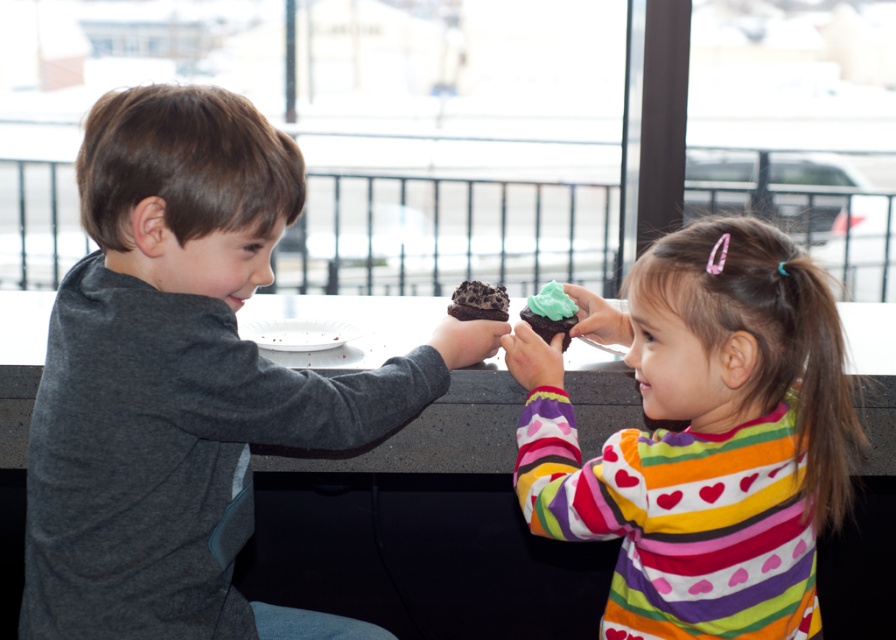
Does pastel striped shirt at center have a lesser height compared to green frosting cupcake at center?

In fact, pastel striped shirt at center may be taller than green frosting cupcake at center.

Does pastel striped shirt at center have a smaller size compared to green frosting cupcake at center?

No.

Identify the location of pastel striped shirt at center. The width and height of the screenshot is (896, 640). (701, 436).

Between dark gray shirt at left and green frosting cupcake at center, which one appears on the left side from the viewer's perspective?

Positioned to the left is dark gray shirt at left.

Is point (157, 488) farther from camera compared to point (569, 317)?

No.

Find the location of a particular element. The image size is (896, 640). dark gray shirt at left is located at coordinates (184, 380).

Is pastel striped shirt at center to the right of chocolate cake at center from the viewer's perspective?

Indeed, pastel striped shirt at center is positioned on the right side of chocolate cake at center.

Measure the distance between point (712, 291) and camera.

Point (712, 291) is 1.10 meters away from camera.

Locate an element on the screen. This screenshot has height=640, width=896. pastel striped shirt at center is located at coordinates (701, 436).